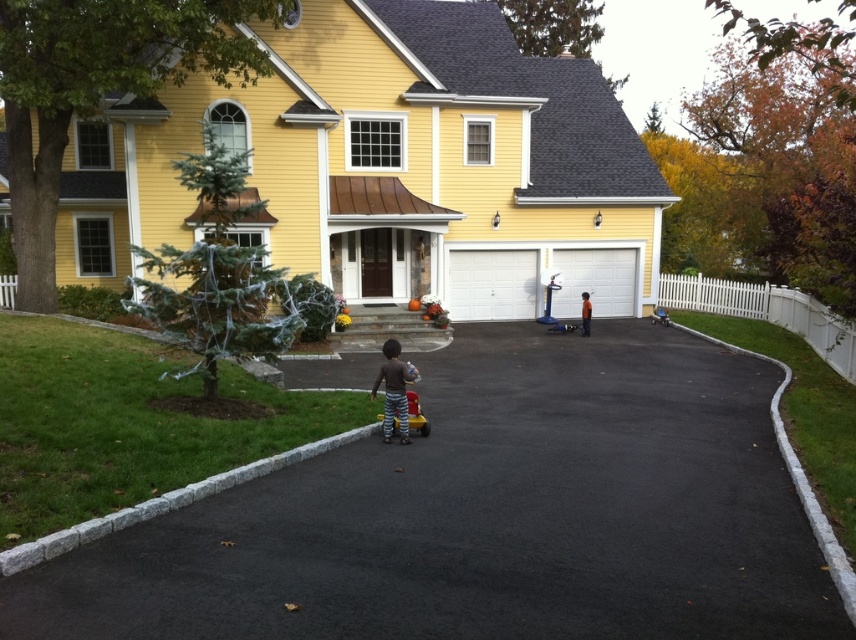
Can you confirm if black asphalt driveway at center is wider than plastic red toy car at center?

Yes.

Which of these two, black asphalt driveway at center or plastic red toy car at center, stands shorter?

Standing shorter between the two is plastic red toy car at center.

Measure the distance between black asphalt driveway at center and camera.

A distance of 13.46 feet exists between black asphalt driveway at center and camera.

I want to click on black asphalt driveway at center, so click(x=488, y=516).

Is brown striped pants at center to the left of orange cotton shirt at center from the viewer's perspective?

Indeed, brown striped pants at center is positioned on the left side of orange cotton shirt at center.

The height and width of the screenshot is (640, 856). Identify the location of brown striped pants at center. (393, 390).

Is point (578, 616) closer to camera compared to point (583, 296)?

Yes, it is in front of point (583, 296).

Who is higher up, black asphalt driveway at center or orange cotton shirt at center?

orange cotton shirt at center is above.

Is point (497, 413) in front of point (587, 301)?

Yes, point (497, 413) is closer to viewer.

You are a GUI agent. You are given a task and a screenshot of the screen. Output one action in this format:
    pyautogui.click(x=<x>, y=<y>)
    Task: Click on the black asphalt driveway at center
    The image size is (856, 640).
    Given the screenshot: What is the action you would take?
    488,516